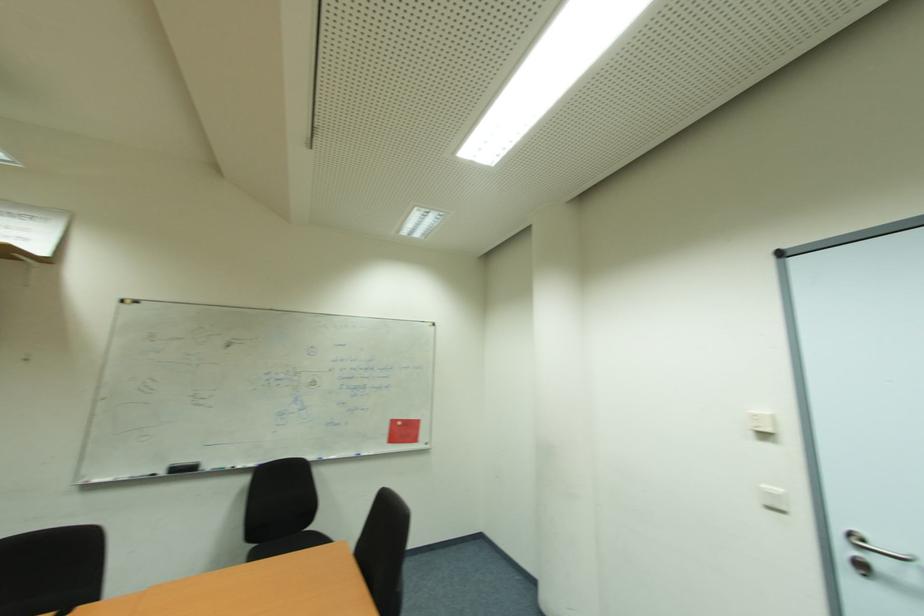
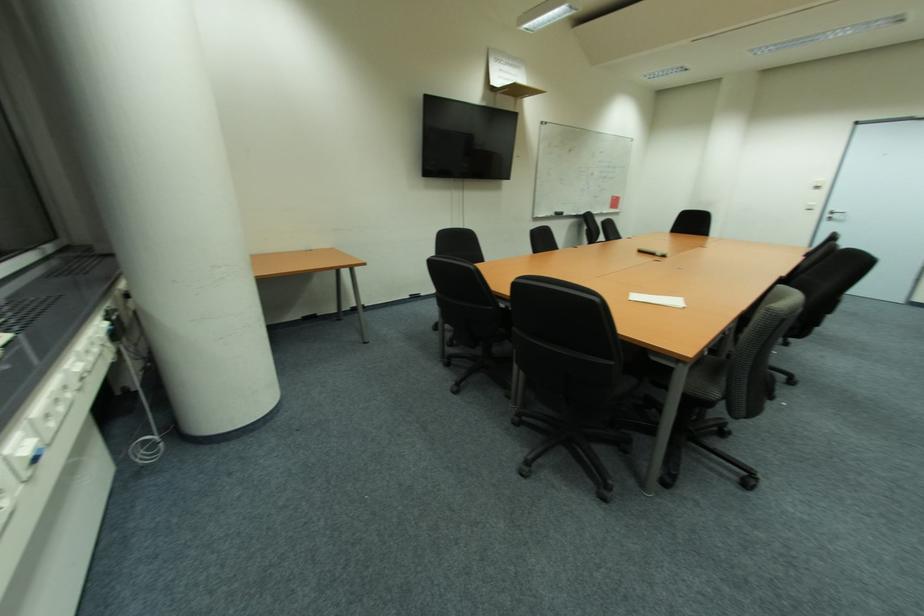
Locate, in the second image, the point that corresponds to point (756, 435) in the first image.

(820, 188)